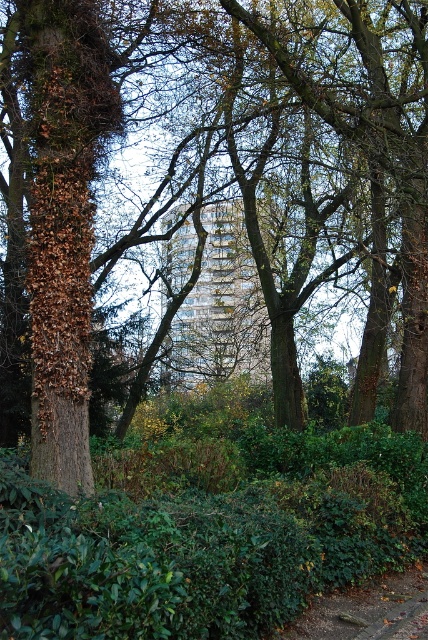
Can you confirm if green leafy hedge at center is wider than brown gravel path at lower center?

No.

Consider the image. Is green leafy hedge at center smaller than brown gravel path at lower center?

Correct, green leafy hedge at center occupies less space than brown gravel path at lower center.

What do you see at coordinates (208, 534) in the screenshot? I see `green leafy hedge at center` at bounding box center [208, 534].

At what (x,y) coordinates should I click in order to perform the action: click on green leafy hedge at center. Please return your answer as a coordinate pair (x, y). This screenshot has width=428, height=640. Looking at the image, I should click on (208, 534).

Which is more to the left, glassy reflective building at center or brown gravel path at lower center?

Positioned to the left is glassy reflective building at center.

Does point (214, 282) lie behind point (368, 614)?

Yes.

The width and height of the screenshot is (428, 640). Describe the element at coordinates (220, 308) in the screenshot. I see `glassy reflective building at center` at that location.

This screenshot has width=428, height=640. Identify the location of glassy reflective building at center. (220, 308).

Measure the distance between green leafy hedge at center and camera.

green leafy hedge at center is 3.48 meters away from camera.

Which is above, green leafy hedge at center or glassy reflective building at center?

Positioned higher is glassy reflective building at center.

Which is in front, point (151, 563) or point (181, 307)?

Point (151, 563)

Locate an element on the screen. green leafy hedge at center is located at coordinates (208, 534).